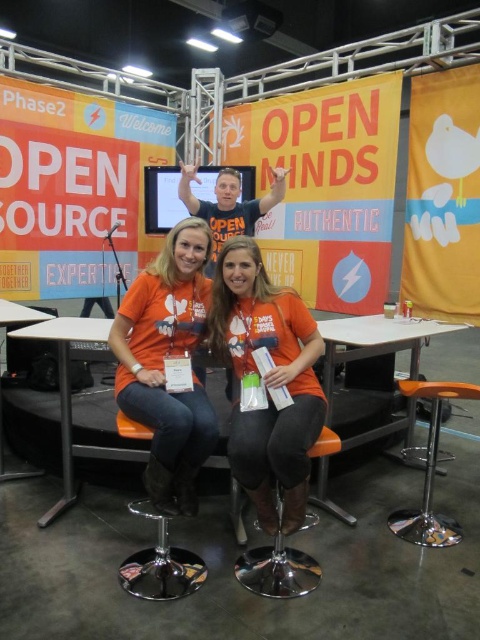
You are standing at the back of the conference hall and want to grab a pamphlet from the matte black table at lower left. However, there is an orange plastic stool at lower right in your way. Can you reach the table without moving the stool?

The orange plastic stool at lower right is closer to the viewer than the matte black table at lower left, so the stool is between you and the table. Therefore, you cannot reach the table without moving the stool.

You are standing at the center of the image. Which direction should you move to reach the orange plastic stool at lower right?

You should move towards the lower right direction to reach the orange plastic stool at lower right.

You are standing at the entrance of the conference booth and need to place a heavy laptop on a surface. Which object from the orange plastic table at lower right and the orange plastic stool at lower right would be more stable for placing the laptop?

The orange plastic table at lower right is located above the orange plastic stool at lower right, meaning the table is a more stable surface for placing the laptop since it is positioned higher and likely has a flat surface.